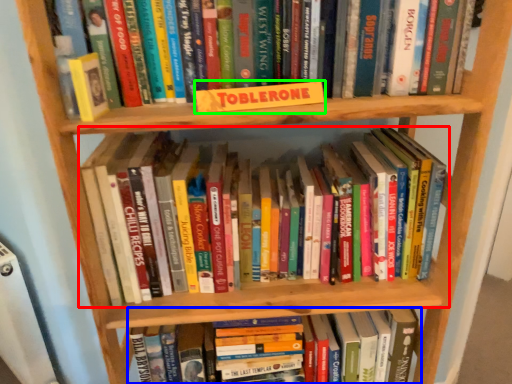
Question: Based on their relative distances, which object is farther from book (highlighted by a red box)? Choose from book (highlighted by a blue box) and paperback book (highlighted by a green box).

Choices:
 (A) book
 (B) paperback book

Answer: (A)